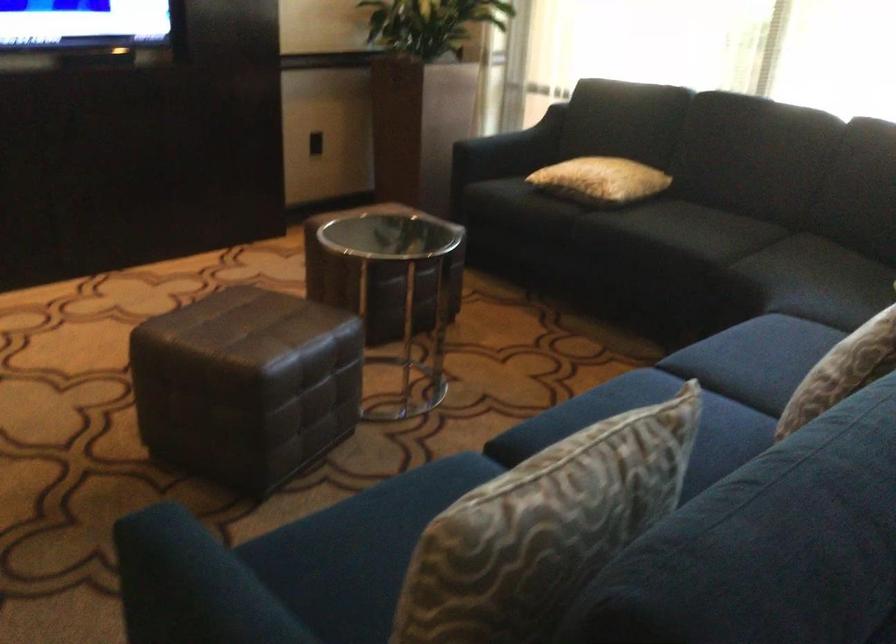
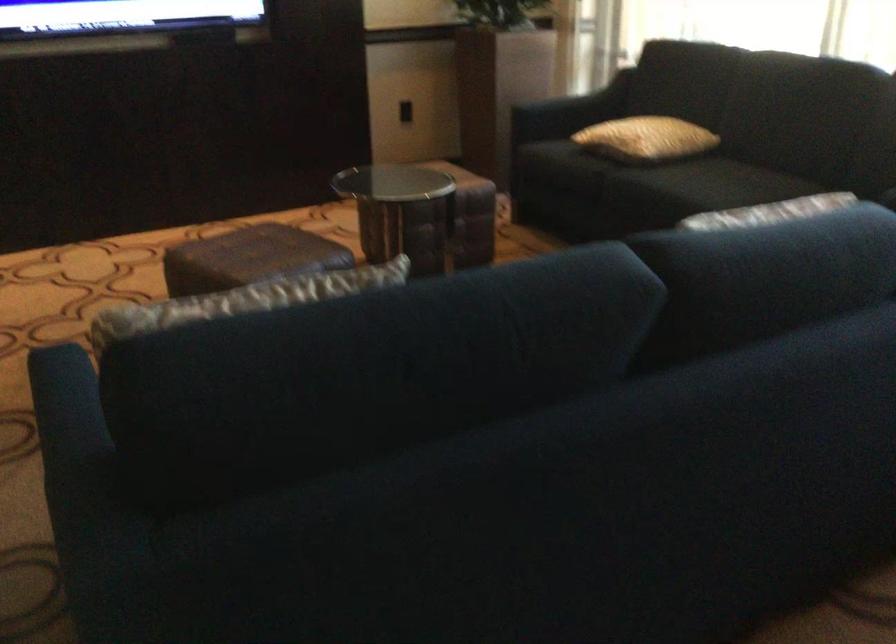
In the second image, find the point that corresponds to point 565,450 in the first image.

(252, 298)